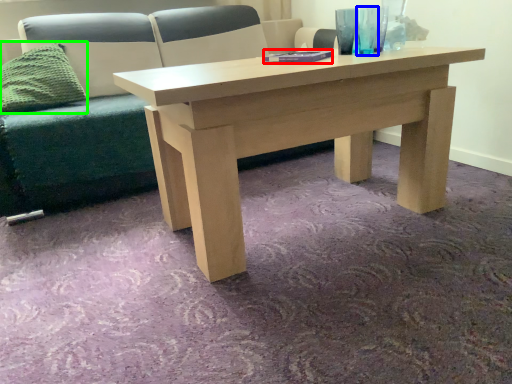
Question: Which object is positioned closest to book (highlighted by a red box)? Select from glass vase (highlighted by a blue box) and pillow (highlighted by a green box).

Choices:
 (A) glass vase
 (B) pillow

Answer: (A)